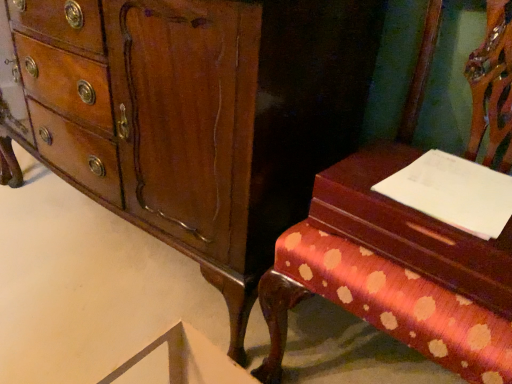
Question: From a real-world perspective, is polka dot fabric bench at right physically located above or below wooden vanity at right?

Choices:
 (A) below
 (B) above

Answer: (A)

Question: Visually, is polka dot fabric bench at right positioned to the left or to the right of wooden vanity at right?

Choices:
 (A) right
 (B) left

Answer: (A)

Question: Which object is positioned farthest from the mahogany wood chest of drawers at center?

Choices:
 (A) polka dot fabric bench at right
 (B) wooden vanity at right
 (C) white paper at right

Answer: (C)

Question: Which object is the farthest from the white paper at right?

Choices:
 (A) mahogany wood chest of drawers at center
 (B) wooden vanity at right
 (C) polka dot fabric bench at right

Answer: (A)